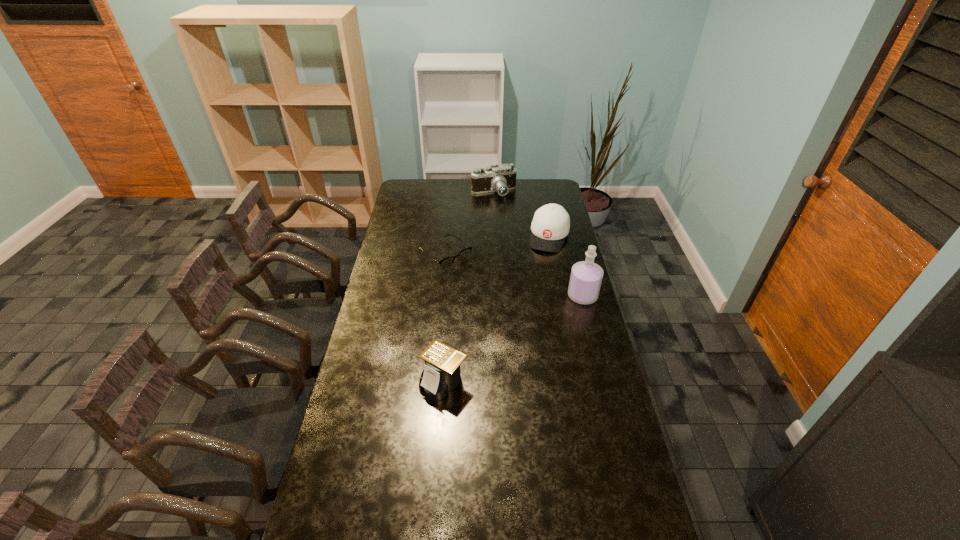
Image resolution: width=960 pixels, height=540 pixels. What are the coordinates of `calculator` in the screenshot? It's located at (441, 374).

Locate an element on the screen. The width and height of the screenshot is (960, 540). perfume is located at coordinates click(x=586, y=276).

The width and height of the screenshot is (960, 540). What are the coordinates of `the tallest object` in the screenshot? It's located at (586, 276).

You are a GUI agent. You are given a task and a screenshot of the screen. Output one action in this format:
    pyautogui.click(x=<x>, y=<y>)
    Task: Click on the shortest object
    
    Given the screenshot: What is the action you would take?
    pyautogui.click(x=446, y=263)

The image size is (960, 540). In order to click on baseball cap in this screenshot , I will do `click(551, 223)`.

Image resolution: width=960 pixels, height=540 pixels. Find the location of `the farthest object`. the farthest object is located at coordinates (501, 178).

Locate an element on the screen. This screenshot has width=960, height=540. vacant area situated 0.060m on the left of the calculator is located at coordinates (402, 381).

This screenshot has width=960, height=540. I want to click on blank space located on the back of the perfume, so click(x=568, y=240).

Locate an element on the screen. Image resolution: width=960 pixels, height=540 pixels. free spot located on the face of the spectacles is located at coordinates (476, 282).

Find the location of a particular element. This screenshot has width=960, height=540. free space located on the face of the spectacles is located at coordinates (516, 315).